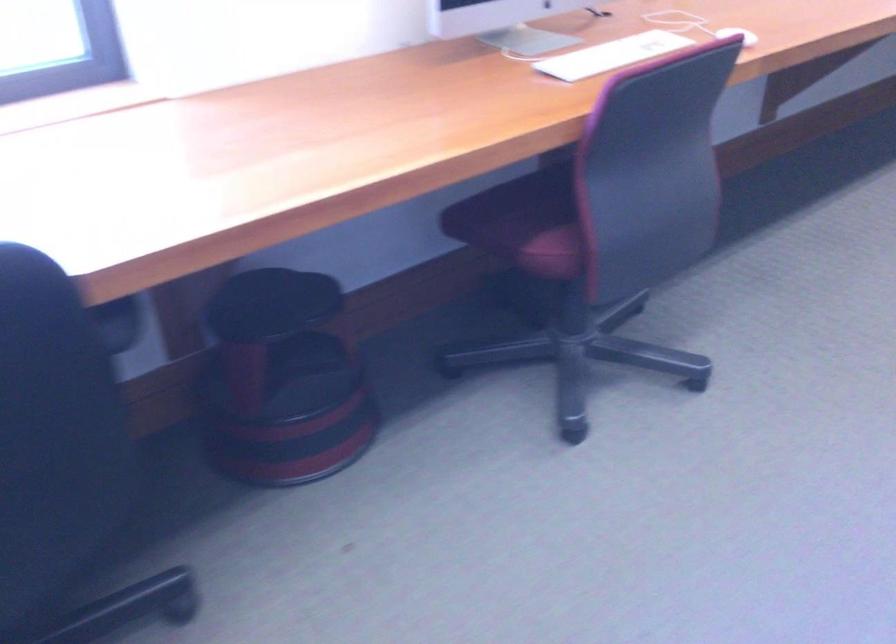
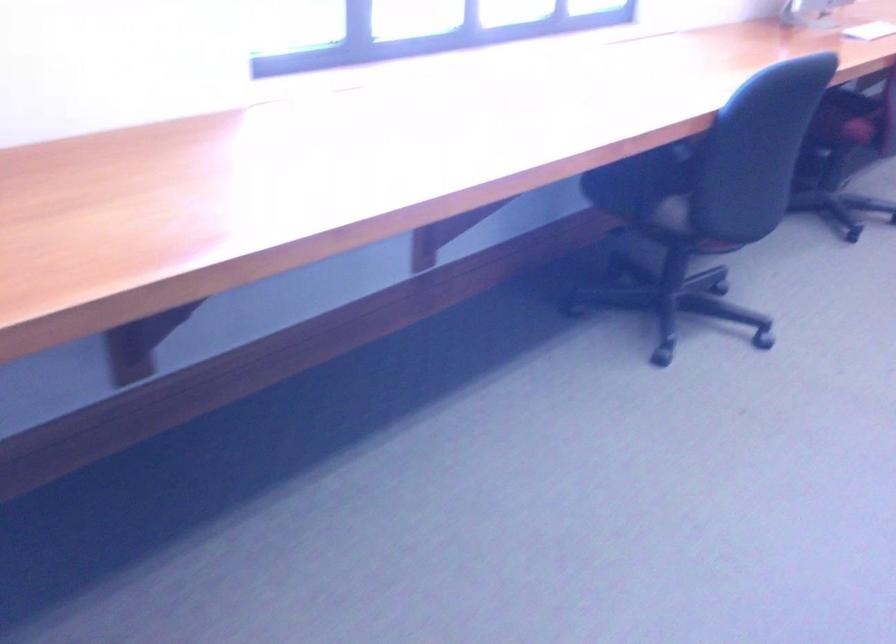
Which direction would the cameraman need to move to produce the second image?

The movement direction of the cameraman is left, backward.